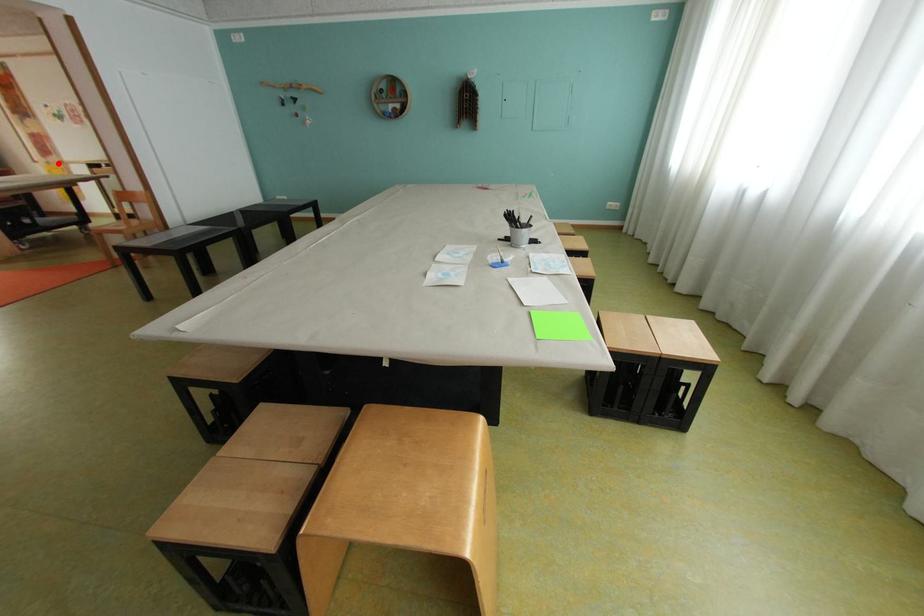
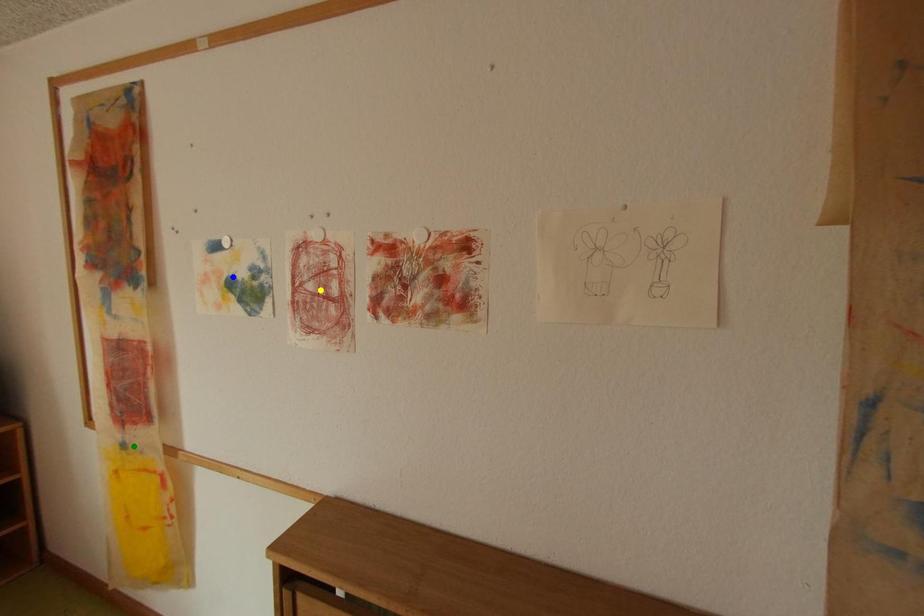
Question: I am providing you with two images of the same scene from different viewpoints. A red point is marked on the first image. You are given multiple points on the second image. Which point in image 2 represents the same 3d spot as the red point in image 1?

Choices:
 (A) yellow point
 (B) blue point
 (C) green point

Answer: (C)